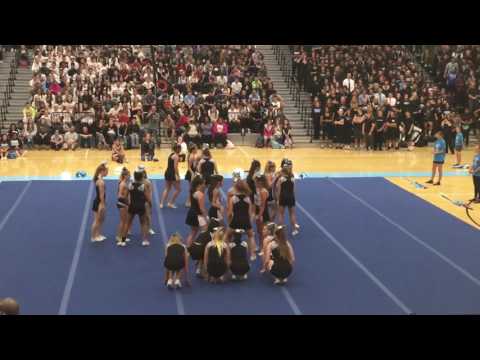
This screenshot has height=360, width=480. What are the coordinates of `stairs` in the screenshot? It's located at [17, 98], [275, 77].